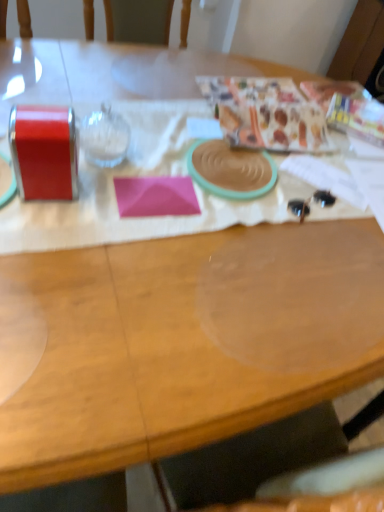
Question: Considering the relative sizes of patterned paper at upper right, marked as the first wrapping paper in a right-to-left arrangement, and matte plastic bag at upper right, arranged as the 1th wrapping paper when viewed from the left, in the image provided, is patterned paper at upper right, marked as the first wrapping paper in a right-to-left arrangement, smaller than matte plastic bag at upper right, arranged as the 1th wrapping paper when viewed from the left,?

Choices:
 (A) yes
 (B) no

Answer: (A)

Question: Does patterned paper at upper right, which is counted as the 2th wrapping paper, starting from the left, appear on the right side of matte plastic bag at upper right, arranged as the 1th wrapping paper when viewed from the left?

Choices:
 (A) yes
 (B) no

Answer: (A)

Question: Can you confirm if patterned paper at upper right, which is counted as the 2th wrapping paper, starting from the left, is shorter than matte plastic bag at upper right, arranged as the 2th wrapping paper when viewed from the right?

Choices:
 (A) yes
 (B) no

Answer: (A)

Question: From a real-world perspective, is patterned paper at upper right, which is counted as the 2th wrapping paper, starting from the left, on matte plastic bag at upper right, arranged as the 1th wrapping paper when viewed from the left?

Choices:
 (A) no
 (B) yes

Answer: (A)

Question: Is patterned paper at upper right, which is counted as the 2th wrapping paper, starting from the left, oriented away from matte plastic bag at upper right, arranged as the 2th wrapping paper when viewed from the right?

Choices:
 (A) no
 (B) yes

Answer: (A)

Question: From a real-world perspective, is transparent glass at upper left above or below patterned paper at upper right, which is counted as the 2th wrapping paper, starting from the left?

Choices:
 (A) above
 (B) below

Answer: (A)

Question: Considering the positions of point (84, 130) and point (326, 80), is point (84, 130) closer or farther from the camera than point (326, 80)?

Choices:
 (A) closer
 (B) farther

Answer: (A)

Question: Relative to patterned paper at upper right, marked as the first wrapping paper in a right-to-left arrangement, is transparent glass at upper left in front or behind?

Choices:
 (A) behind
 (B) front

Answer: (B)

Question: In terms of height, does transparent glass at upper left look taller or shorter compared to patterned paper at upper right, which is counted as the 2th wrapping paper, starting from the left?

Choices:
 (A) short
 (B) tall

Answer: (B)

Question: Is point (339, 129) closer or farther from the camera than point (309, 150)?

Choices:
 (A) closer
 (B) farther

Answer: (B)

Question: Is patterned paper at upper right, which is counted as the 2th wrapping paper, starting from the left, taller or shorter than matte plastic bag at upper right, arranged as the 1th wrapping paper when viewed from the left?

Choices:
 (A) tall
 (B) short

Answer: (B)

Question: Is patterned paper at upper right, marked as the first wrapping paper in a right-to-left arrangement, inside or outside of matte plastic bag at upper right, arranged as the 1th wrapping paper when viewed from the left?

Choices:
 (A) outside
 (B) inside

Answer: (A)

Question: Relative to matte plastic bag at upper right, arranged as the 2th wrapping paper when viewed from the right, is patterned paper at upper right, which is counted as the 2th wrapping paper, starting from the left, in front or behind?

Choices:
 (A) front
 (B) behind

Answer: (B)

Question: From the image's perspective, relative to matte plastic bag at upper right, arranged as the 2th wrapping paper when viewed from the right, is pink matte paper at center above or below?

Choices:
 (A) above
 (B) below

Answer: (B)

Question: In the image, is pink matte paper at center on the left side or the right side of matte plastic bag at upper right, arranged as the 2th wrapping paper when viewed from the right?

Choices:
 (A) right
 (B) left

Answer: (B)